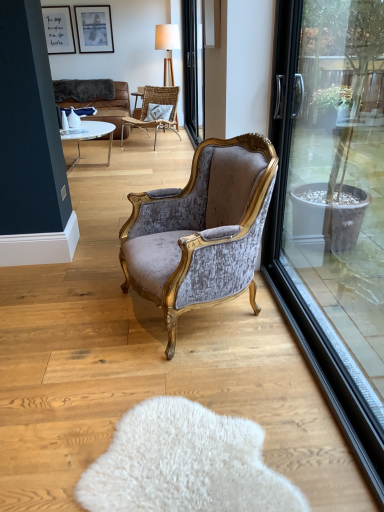
What do you see at coordinates (185, 464) in the screenshot? This screenshot has width=384, height=512. I see `white fluffy rug at lower center` at bounding box center [185, 464].

This screenshot has height=512, width=384. What do you see at coordinates (94, 28) in the screenshot?
I see `matte black picture frame at upper center, the 2th picture frame in the left-to-right sequence` at bounding box center [94, 28].

In the scene shown: In order to face matte black picture frame at upper center, the 2th picture frame in the left-to-right sequence, should I rotate leftwards or rightwards?

Rotate your view left by about 12.378°.

This screenshot has width=384, height=512. Describe the element at coordinates (167, 48) in the screenshot. I see `wooden textured lamp at upper center` at that location.

What is the approximate height of transparent glass door at right?

The height of transparent glass door at right is 1.51 meters.

Describe the element at coordinates (90, 135) in the screenshot. I see `white glass coffee table at center` at that location.

What is the approximate width of white glass coffee table at center?

The width of white glass coffee table at center is 29.98 inches.

What do you see at coordinates (73, 119) in the screenshot? This screenshot has width=384, height=512. I see `white glossy vase at center, the 2th vase in the front-to-back sequence` at bounding box center [73, 119].

Measure the distance between woven rattan chair at upper center, the 1th chair viewed from the top, and camera.

woven rattan chair at upper center, the 1th chair viewed from the top, is 6.00 meters from camera.

This screenshot has width=384, height=512. Describe the element at coordinates (156, 111) in the screenshot. I see `woven rattan chair at upper center, the 1th chair viewed from the top` at that location.

The image size is (384, 512). I want to click on dark brown leather couch at upper left, so click(108, 106).

Is matte black picture frame at upper center, the 1th picture frame in the right-to-left sequence, aimed at transparent glass door at right?

Yes, matte black picture frame at upper center, the 1th picture frame in the right-to-left sequence, is oriented towards transparent glass door at right.

Looking at their sizes, would you say matte black picture frame at upper center, the 1th picture frame in the right-to-left sequence, is wider or thinner than transparent glass door at right?

Considering their sizes, matte black picture frame at upper center, the 1th picture frame in the right-to-left sequence, looks slimmer than transparent glass door at right.

Does point (91, 15) come closer to viewer compared to point (375, 199)?

That is False.

What's the angular difference between matte black picture frame at upper center, the 2th picture frame in the left-to-right sequence, and transparent glass door at right's facing directions?

They differ by 89.4 degrees in their facing directions.

Is wooden textured lamp at upper center situated inside white fluffy rug at lower center or outside?

wooden textured lamp at upper center lies outside white fluffy rug at lower center.

From a real-world perspective, is wooden textured lamp at upper center physically located above or below white fluffy rug at lower center?

wooden textured lamp at upper center is above white fluffy rug at lower center.

Between wooden textured lamp at upper center and white fluffy rug at lower center, which one has larger size?

wooden textured lamp at upper center is bigger.

From the image's perspective, which one is positioned lower, textured gray pillow at center or transparent glass door at right?

From the image's view, transparent glass door at right is below.

Which object is closer to the camera, textured gray pillow at center or transparent glass door at right?

transparent glass door at right is closer to the camera.

Can you confirm if textured gray pillow at center is positioned to the right of transparent glass door at right?

No.

Is wooden textured lamp at upper center looking in the opposite direction of matte black picture frame at upper left, which is the 2th picture frame in right-to-left order?

No.

Does point (174, 26) appear closer or farther from the camera than point (56, 15)?

Point (174, 26) is positioned farther from the camera compared to point (56, 15).

Can you confirm if wooden textured lamp at upper center is smaller than matte black picture frame at upper left, the 1th picture frame viewed from the left?

No, wooden textured lamp at upper center is not smaller than matte black picture frame at upper left, the 1th picture frame viewed from the left.

Which object is further away from the camera, wooden textured lamp at upper center or matte black picture frame at upper left, the 1th picture frame viewed from the left?

A: matte black picture frame at upper left, the 1th picture frame viewed from the left, is more distant.

Measure the distance from matte black picture frame at upper left, which is the 2th picture frame in right-to-left order, to white glass coffee table at center.

A distance of 8.09 feet exists between matte black picture frame at upper left, which is the 2th picture frame in right-to-left order, and white glass coffee table at center.

From a real-world perspective, is matte black picture frame at upper left, the 1th picture frame viewed from the left, over white glass coffee table at center?

Yes, from a real-world perspective, matte black picture frame at upper left, the 1th picture frame viewed from the left, is over white glass coffee table at center

Can you tell me how much matte black picture frame at upper left, which is the 2th picture frame in right-to-left order, and white glass coffee table at center differ in facing direction?

91 degrees.

Is matte black picture frame at upper left, which is the 2th picture frame in right-to-left order, not close to white glass coffee table at center?

Yes.

Would you say white fluffy rug at lower center is inside or outside dark brown leather couch at upper left?

white fluffy rug at lower center is spatially situated outside dark brown leather couch at upper left.

In the image, is white fluffy rug at lower center on the left side or the right side of dark brown leather couch at upper left?

Based on their positions, white fluffy rug at lower center is located to the right of dark brown leather couch at upper left.

Which is nearer, (219, 503) or (103, 111)?

Point (219, 503)

Are white glossy vase at upper left, acting as the second vase starting from the back, and matte black picture frame at upper left, which is the 2th picture frame in right-to-left order, far apart?

Yes, white glossy vase at upper left, acting as the second vase starting from the back, and matte black picture frame at upper left, which is the 2th picture frame in right-to-left order, are located far from each other.

Between white glossy vase at upper left, acting as the second vase starting from the back, and matte black picture frame at upper left, the 1th picture frame viewed from the left, which one appears on the right side from the viewer's perspective?

Positioned to the right is white glossy vase at upper left, acting as the second vase starting from the back.

In the scene shown: Could you tell me if white glossy vase at upper left, the 1th vase in the front-to-back sequence, is turned towards matte black picture frame at upper left, the 1th picture frame viewed from the left?

No, white glossy vase at upper left, the 1th vase in the front-to-back sequence, is not facing towards matte black picture frame at upper left, the 1th picture frame viewed from the left.

From a real-world perspective, is white glossy vase at upper left, the 1th vase in the front-to-back sequence, physically located above or below matte black picture frame at upper left, the 1th picture frame viewed from the left?

From a real-world perspective, white glossy vase at upper left, the 1th vase in the front-to-back sequence, is physically below matte black picture frame at upper left, the 1th picture frame viewed from the left.

The image size is (384, 512). I want to click on window screen directly beneath the matte black picture frame at upper center, the 1th picture frame in the right-to-left sequence (from a real-world perspective), so click(334, 180).

Where is `lamp above the white fluffy rug at lower center (from a real-world perspective)`? lamp above the white fluffy rug at lower center (from a real-world perspective) is located at coordinates (167, 48).

Looking at this image, based on their spatial positions, is velvet/goldenchair at center, the second chair in the top-to-bottom sequence, or white glass coffee table at center further from dark brown leather couch at upper left?

Among the two, velvet/goldenchair at center, the second chair in the top-to-bottom sequence, is located further to dark brown leather couch at upper left.

When comparing their distances from matte black picture frame at upper left, the 1th picture frame viewed from the left, does woven rattan chair at upper center, the 1th chair viewed from the top, or velvet/goldenchair at center, the second chair from the back, seem further?

velvet/goldenchair at center, the second chair from the back, is further to matte black picture frame at upper left, the 1th picture frame viewed from the left.

From the image, which object appears to be nearer to textured gray pillow at center, woven rattan chair at upper center, marked as the 2th chair in a front-to-back arrangement, or white glossy vase at center, marked as the 1th vase in a back-to-front arrangement?

woven rattan chair at upper center, marked as the 2th chair in a front-to-back arrangement, lies closer to textured gray pillow at center than the other object.

From the picture: Looking at the image, which one is located further to matte black picture frame at upper center, the 2th picture frame in the left-to-right sequence, transparent glass screen door at upper center or white glossy vase at center, marked as the 1th vase in a back-to-front arrangement?

transparent glass screen door at upper center is further to matte black picture frame at upper center, the 2th picture frame in the left-to-right sequence.

In the scene shown: Considering their positions, is matte black picture frame at upper center, the 2th picture frame in the left-to-right sequence, positioned further to velvet/goldenchair at center, the second chair from the back, than woven rattan chair at upper center, the 2th chair in the bottom-to-top sequence?

matte black picture frame at upper center, the 2th picture frame in the left-to-right sequence, is positioned further to the anchor velvet/goldenchair at center, the second chair from the back.

Which object lies further to the anchor point transparent glass door at right, white fluffy rug at lower center or white glass coffee table at center?

white glass coffee table at center.

Which object lies further to the anchor point matte black picture frame at upper left, which is the 2th picture frame in right-to-left order, white glossy vase at upper left, the 1th vase in the front-to-back sequence, or white glass coffee table at center?

white glass coffee table at center is positioned further to the anchor matte black picture frame at upper left, which is the 2th picture frame in right-to-left order.

Looking at the image, which one is located further to dark brown leather couch at upper left, velvet/goldenchair at center, which ranks as the first chair in front-to-back order, or transparent glass screen door at upper center?

The object further to dark brown leather couch at upper left is velvet/goldenchair at center, which ranks as the first chair in front-to-back order.

Identify the location of screen door that lies between matte black picture frame at upper left, which is the 2th picture frame in right-to-left order, and white glossy vase at upper left, acting as the second vase starting from the back, from top to bottom. (193, 69).

You are a GUI agent. You are given a task and a screenshot of the screen. Output one action in this format:
    pyautogui.click(x=<x>, y=<y>)
    Task: Click on the screen door between white fluffy rug at lower center and textured gray pillow at center along the z-axis
    This screenshot has height=512, width=384.
    Given the screenshot: What is the action you would take?
    pyautogui.click(x=193, y=69)

Image resolution: width=384 pixels, height=512 pixels. In order to click on gray located between transparent glass door at right and matte black picture frame at upper center, the 1th picture frame in the right-to-left sequence, in the depth direction in this screenshot , I will do `click(185, 464)`.

At what (x,y) coordinates should I click in order to perform the action: click on pillow between matte black picture frame at upper center, the 1th picture frame in the right-to-left sequence, and white glossy vase at upper left, acting as the second vase starting from the back, from top to bottom. Please return your answer as a coordinate pair (x, y). Looking at the image, I should click on (158, 112).